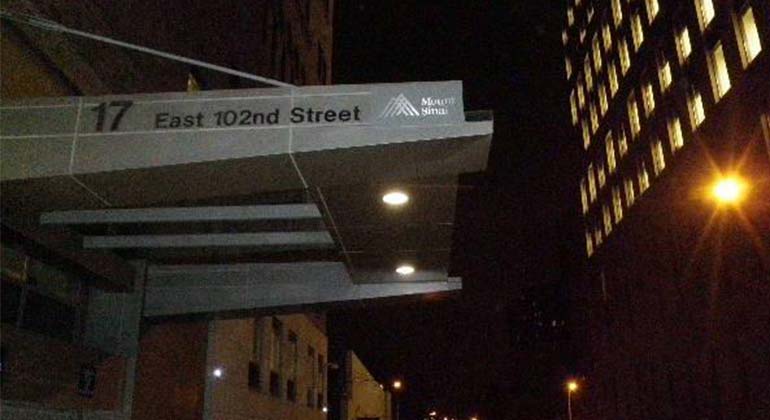
This screenshot has width=770, height=420. I want to click on support bar, so click(x=118, y=44).